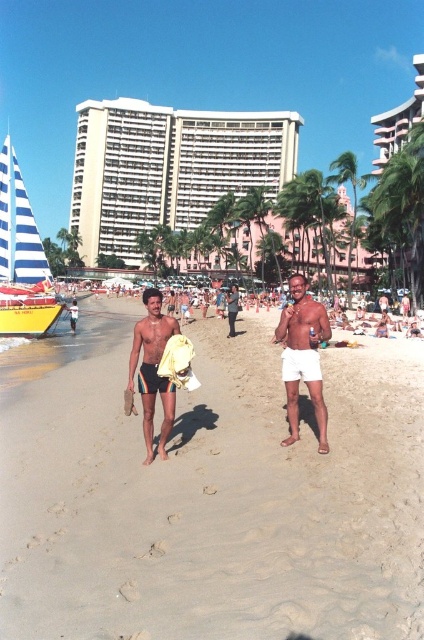
Which of these two, rainbow striped shorts at center or black fabric shorts at center, stands shorter?

Standing shorter between the two is black fabric shorts at center.

Does rainbow striped shorts at center appear under black fabric shorts at center?

Incorrect, rainbow striped shorts at center is not positioned below black fabric shorts at center.

Is point (147, 356) more distant than point (145, 376)?

Yes.

The image size is (424, 640). I want to click on rainbow striped shorts at center, so click(x=153, y=369).

From the picture: Between white matte shorts at center and white cotton shorts at center-right, which one has more height?

white matte shorts at center

Which is above, white matte shorts at center or white cotton shorts at center-right?

white matte shorts at center is higher up.

This screenshot has height=640, width=424. Find the location of `white matte shorts at center`. white matte shorts at center is located at coordinates (303, 356).

Identify the location of white matte shorts at center. The width and height of the screenshot is (424, 640). (303, 356).

Which of these two, white matte shorts at center or rainbow striped shorts at center, stands shorter?

With less height is rainbow striped shorts at center.

What do you see at coordinates (303, 356) in the screenshot? The image size is (424, 640). I see `white matte shorts at center` at bounding box center [303, 356].

Is point (292, 288) positioned before point (144, 413)?

No, (292, 288) is behind (144, 413).

What are the coordinates of `white matte shorts at center` in the screenshot? It's located at (303, 356).